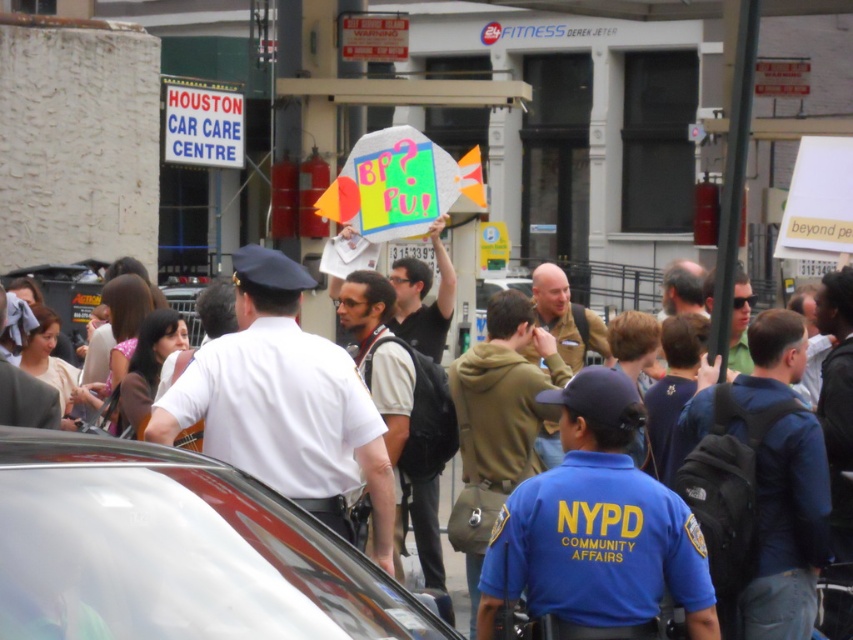
You are a photographer standing at the camera position. You want to capture a closeup of the red plastic sign at upper left. Given that your telephoto lens can focus on objects up to 20 meters away, will you be able to take the photo without moving closer?

The red plastic sign at upper left is 25.00 meters away from camera. Since the telephoto lens can only focus up to 20 meters, you will need to move closer to take the closeup.